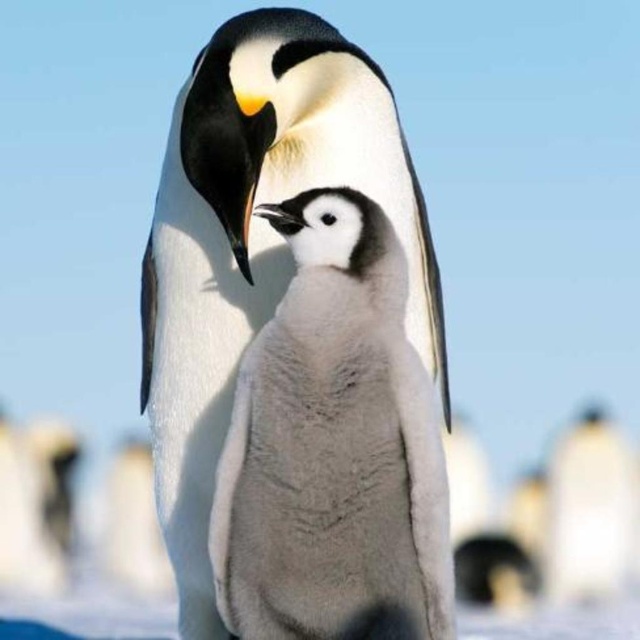
Is white fluffy penguin at center behind white fluffy penguin at lower right?

No.

Is white fluffy penguin at center below white fluffy penguin at lower right?

No.

The height and width of the screenshot is (640, 640). Describe the element at coordinates (256, 248) in the screenshot. I see `white fluffy penguin at center` at that location.

The image size is (640, 640). In order to click on white fluffy penguin at center in this screenshot , I will do `click(256, 248)`.